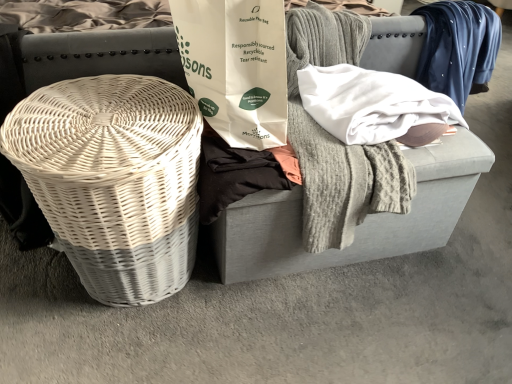
The width and height of the screenshot is (512, 384). Find the location of `spots to the right of gray fabric footrest at center`. spots to the right of gray fabric footrest at center is located at coordinates (469, 257).